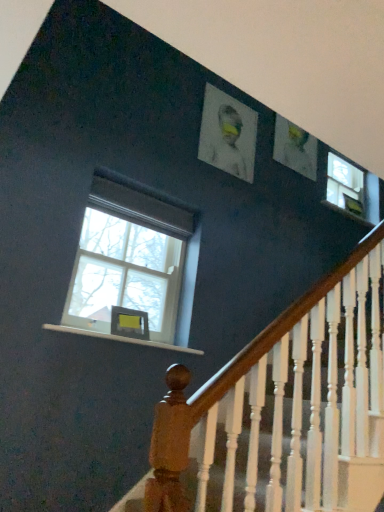
Where is `white matte portrait at upper center`? white matte portrait at upper center is located at coordinates (228, 144).

Locate an element on the screen. white matte portrait at upper center is located at coordinates click(x=228, y=144).

From a real-world perspective, is clear glass window at left positioned under white wood at lower left based on gravity?

No, from a real-world perspective, clear glass window at left is not under white wood at lower left.

Is clear glass window at left oriented away from white wood at lower left?

That's not correct — clear glass window at left is not looking away from white wood at lower left.

Which of these two, clear glass window at left or white wood at lower left, is thinner?

Thinner between the two is clear glass window at left.

Is white wood at lower left inside clear glass window at left?

No.

What's the angular difference between white wood at lower left and clear glass window at left's facing directions?

The angular difference between white wood at lower left and clear glass window at left is 0.37 degrees.

Is white wood at lower left positioned far away from clear glass window at left?

No, there isn't a large distance between white wood at lower left and clear glass window at left.

Can you confirm if white wood at lower left is positioned to the right of clear glass window at left?

Correct, you'll find white wood at lower left to the right of clear glass window at left.

From a real-world perspective, is white wood at lower left positioned above or below clear glass window at left?

From a real-world perspective, white wood at lower left is physically below clear glass window at left.

From the picture: Is white wood at lower left to the right of white matte portrait at upper center from the viewer's perspective?

Incorrect, white wood at lower left is not on the right side of white matte portrait at upper center.

Identify the location of window sill below the white matte portrait at upper center (from a real-world perspective). This screenshot has height=512, width=384. (120, 338).

Is white wood at lower left turned away from white matte portrait at upper center?

That's not correct — white wood at lower left is not looking away from white matte portrait at upper center.

From the picture: From the image's perspective, which is below, white wood at lower left or white matte portrait at upper center?

white wood at lower left.

Considering the relative sizes of white matte portrait at upper center and clear glass window at left in the image provided, is white matte portrait at upper center thinner than clear glass window at left?

Yes.

Considering the relative sizes of white matte portrait at upper center and clear glass window at left in the image provided, is white matte portrait at upper center shorter than clear glass window at left?

Correct, white matte portrait at upper center is not as tall as clear glass window at left.

Is white matte portrait at upper center not near clear glass window at left?

No, there isn't a large distance between white matte portrait at upper center and clear glass window at left.

Is white matte portrait at upper center to the left or to the right of clear glass window at left in the image?

white matte portrait at upper center is positioned on clear glass window at left's right side.

Between white matte portrait at upper center and white wood at lower left, which one appears on the right side from the viewer's perspective?

Positioned to the right is white matte portrait at upper center.

Is white matte portrait at upper center with white wood at lower left?

No, white matte portrait at upper center is not touching white wood at lower left.

Find the location of a particular element. person behind the white wood at lower left is located at coordinates (228, 144).

Can you tell me how much white matte portrait at upper center and white wood at lower left differ in facing direction?

0.145 degrees.

You are a GUI agent. You are given a task and a screenshot of the screen. Output one action in this format:
    pyautogui.click(x=<x>, y=<y>)
    Task: Click on the window below the white matte portrait at upper center (from a real-world perspective)
    
    Given the screenshot: What is the action you would take?
    pyautogui.click(x=134, y=264)

Is clear glass window at left bigger than white matte portrait at upper center?

Indeed, clear glass window at left has a larger size compared to white matte portrait at upper center.

Is clear glass window at left taller or shorter than white matte portrait at upper center?

clear glass window at left is taller than white matte portrait at upper center.

From a real-world perspective, is clear glass window at left physically located above or below white matte portrait at upper center?

In terms of real-world spatial position, clear glass window at left is below white matte portrait at upper center.

Where is `window above the white wood at lower left (from a real-world perspective)`? window above the white wood at lower left (from a real-world perspective) is located at coordinates (134, 264).

Find the location of a particular element. This screenshot has height=512, width=384. window sill on the right of clear glass window at left is located at coordinates (120, 338).

Which object lies further to the anchor point white wood at lower left, white matte portrait at upper center or clear glass window at left?

Among the two, white matte portrait at upper center is located further to white wood at lower left.

When comparing their distances from white wood at lower left, does clear glass window at left or white matte portrait at upper center seem further?

white matte portrait at upper center is positioned further to the anchor white wood at lower left.

Considering their positions, is white wood at lower left positioned further to white matte portrait at upper center than clear glass window at left?

Based on the image, white wood at lower left appears to be further to white matte portrait at upper center.

From the image, which object appears to be nearer to white matte portrait at upper center, clear glass window at left or white wood at lower left?

Based on the image, clear glass window at left appears to be nearer to white matte portrait at upper center.

When comparing their distances from clear glass window at left, does white matte portrait at upper center or white wood at lower left seem further?

Based on the image, white matte portrait at upper center appears to be further to clear glass window at left.

Which object lies further to the anchor point clear glass window at left, white wood at lower left or white matte portrait at upper center?

Among the two, white matte portrait at upper center is located further to clear glass window at left.

You are a GUI agent. You are given a task and a screenshot of the screen. Output one action in this format:
    pyautogui.click(x=<x>, y=<y>)
    Task: Click on the window that lies between white matte portrait at upper center and white wood at lower left from top to bottom
    Image resolution: width=384 pixels, height=512 pixels.
    Given the screenshot: What is the action you would take?
    pyautogui.click(x=134, y=264)